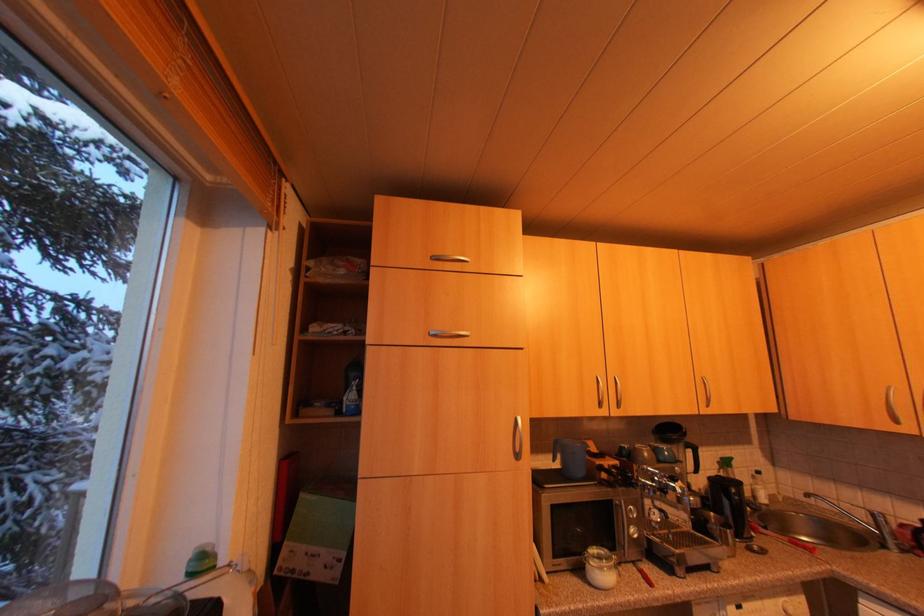
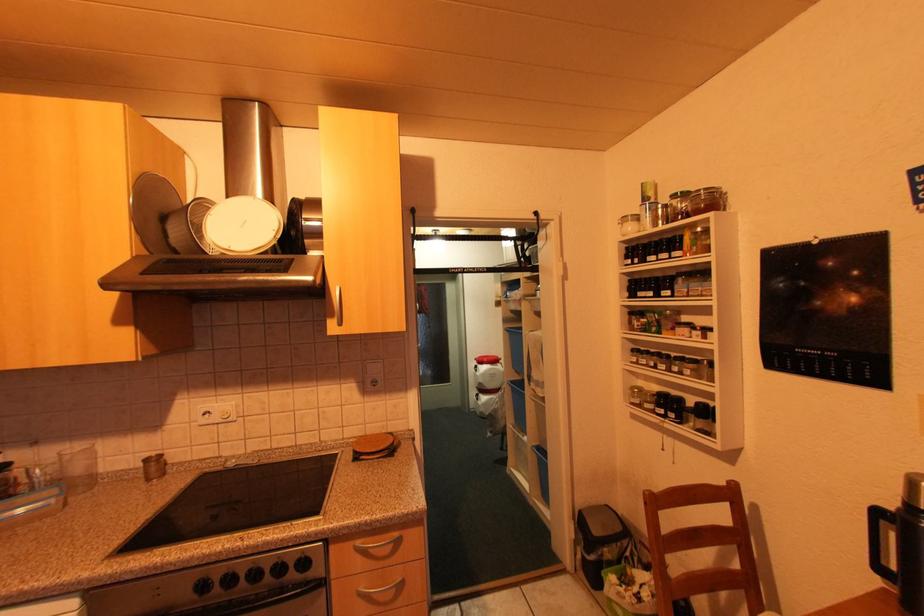
Question: The first image is from the beginning of the video and the second image is from the end. How did the camera likely rotate when shooting the video?

Choices:
 (A) Left
 (B) Right
 (C) Up
 (D) Down

Answer: (B)